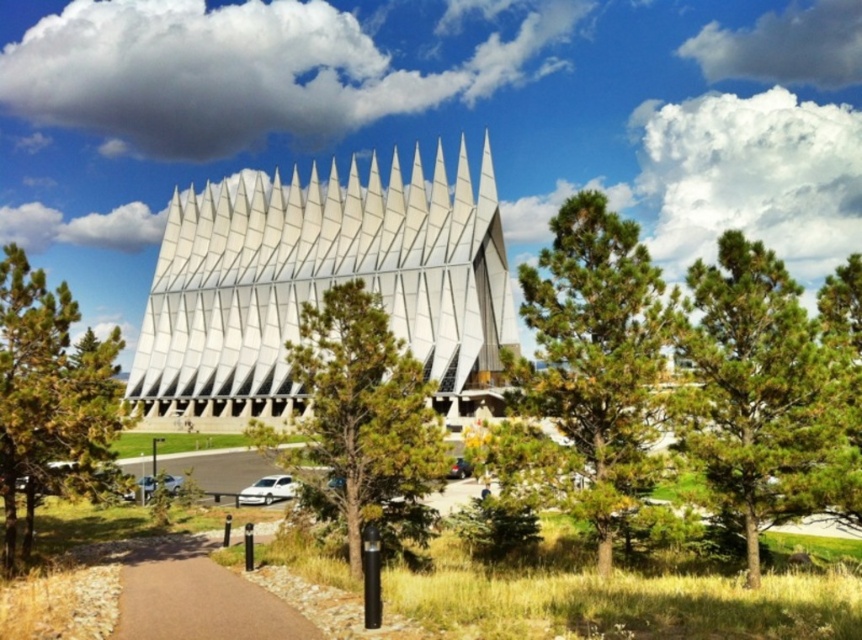
Consider the image. Who is taller, green needle-like leaves at center or green textured tree at center-left?

With more height is green textured tree at center-left.

Between point (728, 433) and point (35, 371), which one is positioned behind?

Positioned behind is point (35, 371).

The height and width of the screenshot is (640, 862). Identify the location of green needle-like leaves at center. (759, 392).

Who is taller, green textured tree at center or green pine tree at upper right?

green textured tree at center is taller.

Who is more forward, (361,547) or (859,515)?

Point (859,515) is more forward.

Image resolution: width=862 pixels, height=640 pixels. Identify the location of green textured tree at center. (364, 422).

Where is `green textured tree at center-left`? Image resolution: width=862 pixels, height=640 pixels. green textured tree at center-left is located at coordinates (50, 397).

Is green textured tree at center-left taller than brown asphalt path at lower left?

Yes, green textured tree at center-left is taller than brown asphalt path at lower left.

I want to click on green textured tree at center-left, so click(50, 397).